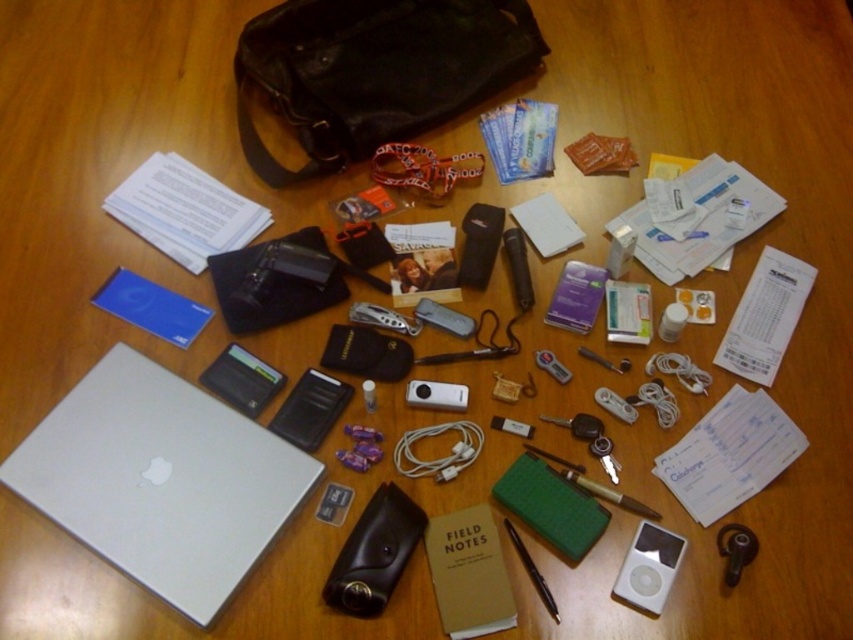
You are a GUI agent. You are given a task and a screenshot of the screen. Output one action in this format:
    pyautogui.click(x=<x>, y=<y>)
    Task: Click on the silver metallic laptop at lower left
    The image size is (853, 640).
    Given the screenshot: What is the action you would take?
    pyautogui.click(x=160, y=480)

Based on the photo, does silver metallic laptop at lower left have a larger size compared to black leather bag at upper center?

Incorrect, silver metallic laptop at lower left is not larger than black leather bag at upper center.

Locate an element on the screen. silver metallic laptop at lower left is located at coordinates (160, 480).

Locate an element on the screen. This screenshot has height=640, width=853. silver metallic laptop at lower left is located at coordinates (160, 480).

Between black leather bag at upper center and black matte pen at center, which one appears on the left side from the viewer's perspective?

From the viewer's perspective, black leather bag at upper center appears more on the left side.

Which is more to the right, black leather bag at upper center or black matte pen at center?

Positioned to the right is black matte pen at center.

Does point (436, 84) come behind point (538, 579)?

Yes, it is behind point (538, 579).

Where is `black leather bag at upper center`? The width and height of the screenshot is (853, 640). black leather bag at upper center is located at coordinates (374, 72).

Is silver metallic laptop at lower left bigger than black matte pen at center?

Indeed, silver metallic laptop at lower left has a larger size compared to black matte pen at center.

Between point (186, 513) and point (519, 547), which one is positioned in front?

Point (519, 547) is more forward.

Describe the element at coordinates (160, 480) in the screenshot. I see `silver metallic laptop at lower left` at that location.

Find the location of a particular element. silver metallic laptop at lower left is located at coordinates (160, 480).